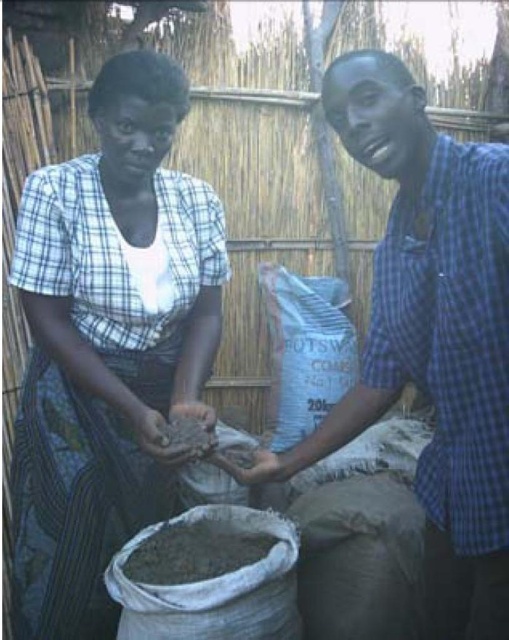
Is point (351, 109) positioned after point (205, 436)?

That is False.

Between blue checkered shirt at center and brown clay at center, which one is positioned higher?

blue checkered shirt at center is higher up.

I want to click on blue checkered shirt at center, so click(432, 336).

This screenshot has height=640, width=509. Find the location of `white cotton dress at center`. white cotton dress at center is located at coordinates (107, 342).

Is white cotton dress at center bigger than brown clay at center?

Yes, white cotton dress at center is bigger than brown clay at center.

Is point (189, 401) farther from viewer compared to point (175, 429)?

Yes, it is.

Locate an element on the screen. This screenshot has height=640, width=509. white cotton dress at center is located at coordinates (107, 342).

Is point (463, 196) positioned before point (249, 540)?

Yes, it is in front of point (249, 540).

Between blue checkered shirt at center and gray matte sand at center, which one has more height?

blue checkered shirt at center

You are a GUI agent. You are given a task and a screenshot of the screen. Output one action in this format:
    pyautogui.click(x=<x>, y=<y>)
    Task: Click on the blue checkered shirt at center
    
    Given the screenshot: What is the action you would take?
    pyautogui.click(x=432, y=336)